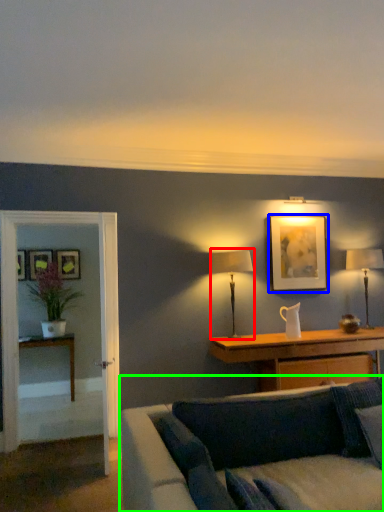
Question: Which object is the closest to the table lamp (highlighted by a red box)? Choose among these: picture frame (highlighted by a blue box) or studio couch (highlighted by a green box).

Choices:
 (A) picture frame
 (B) studio couch

Answer: (A)